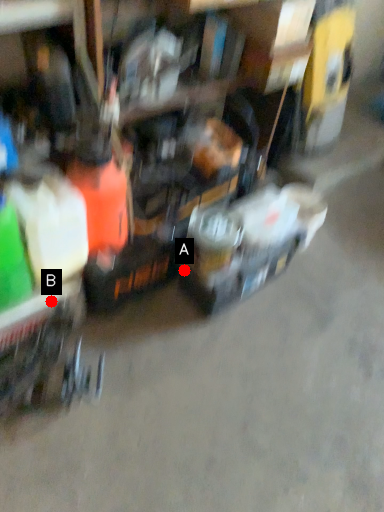
Question: Two points are circled on the image, labeled by A and B beside each circle. Which point is closer to the camera?

Choices:
 (A) A is closer
 (B) B is closer

Answer: (B)